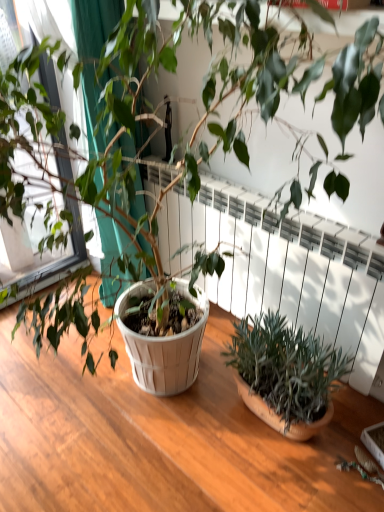
This screenshot has width=384, height=512. What are the coordinates of `vacant space in front of green matte plant at lower right` in the screenshot? It's located at (280, 480).